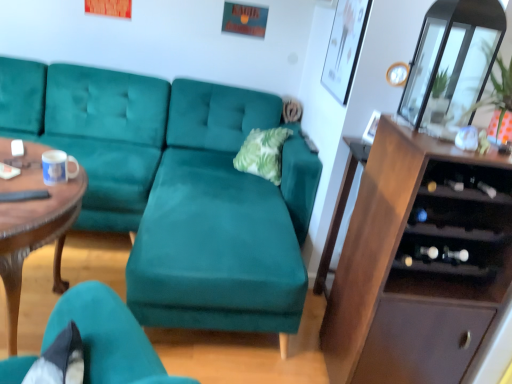
Identify the location of vacant space in front of white glossy mug at center. (37, 198).